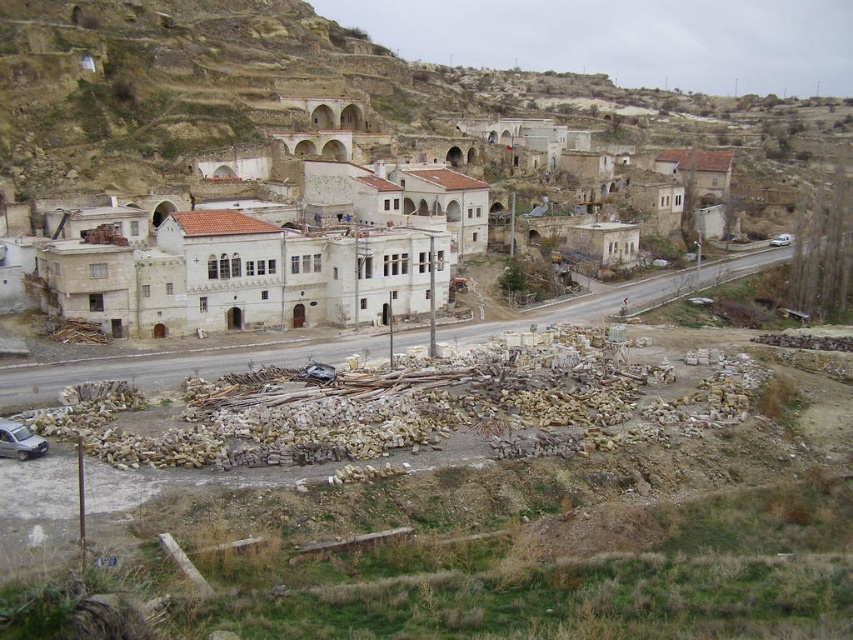
Question: Which object is positioned closest to the white stone buildings at center?

Choices:
 (A) silver metallic car at lower left
 (B) stone rubble at center

Answer: (B)

Question: Which of these objects is positioned closest to the stone rubble at center?

Choices:
 (A) white stone buildings at center
 (B) silver metallic car at lower left

Answer: (A)

Question: Is stone rubble at center closer to camera compared to silver metallic car at lower left?

Choices:
 (A) yes
 (B) no

Answer: (B)

Question: Which object is positioned farthest from the stone rubble at center?

Choices:
 (A) white stone buildings at center
 (B) silver metallic car at lower left

Answer: (B)

Question: Considering the relative positions of white stone buildings at center and stone rubble at center in the image provided, where is white stone buildings at center located with respect to stone rubble at center?

Choices:
 (A) above
 (B) below

Answer: (A)

Question: Can you confirm if white stone buildings at center is wider than silver metallic car at lower left?

Choices:
 (A) no
 (B) yes

Answer: (B)